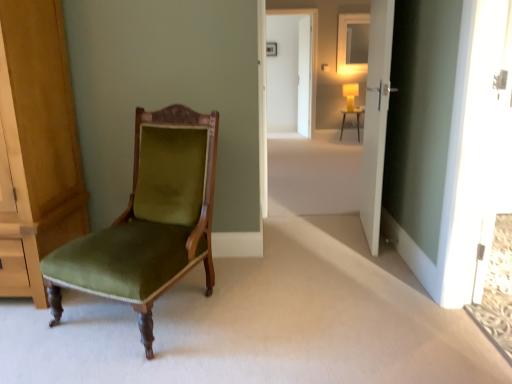
Where is `free spot in front of velvet green chair at left`? The image size is (512, 384). free spot in front of velvet green chair at left is located at coordinates (128, 361).